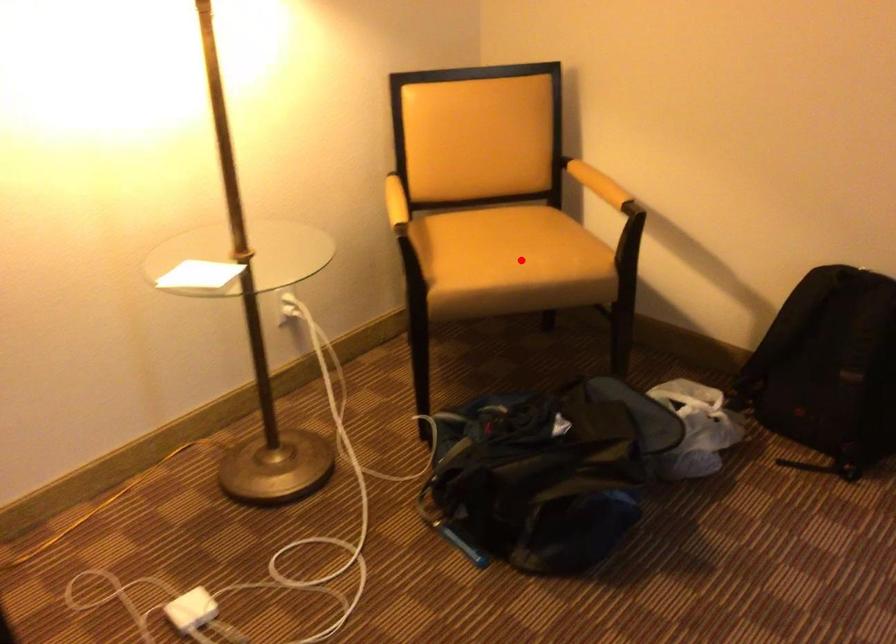
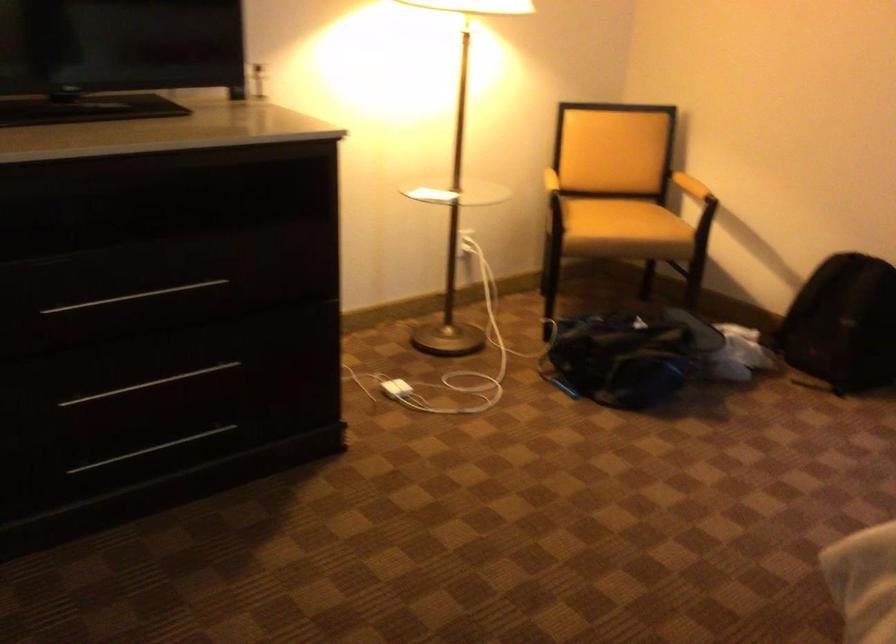
Question: A red point is marked in image1. In image2, is the corresponding 3D point closer to the camera or farther? Reply with the corresponding letter.

Choices:
 (A) The corresponding 3D point is closer.
 (B) The corresponding 3D point is farther.

Answer: (B)